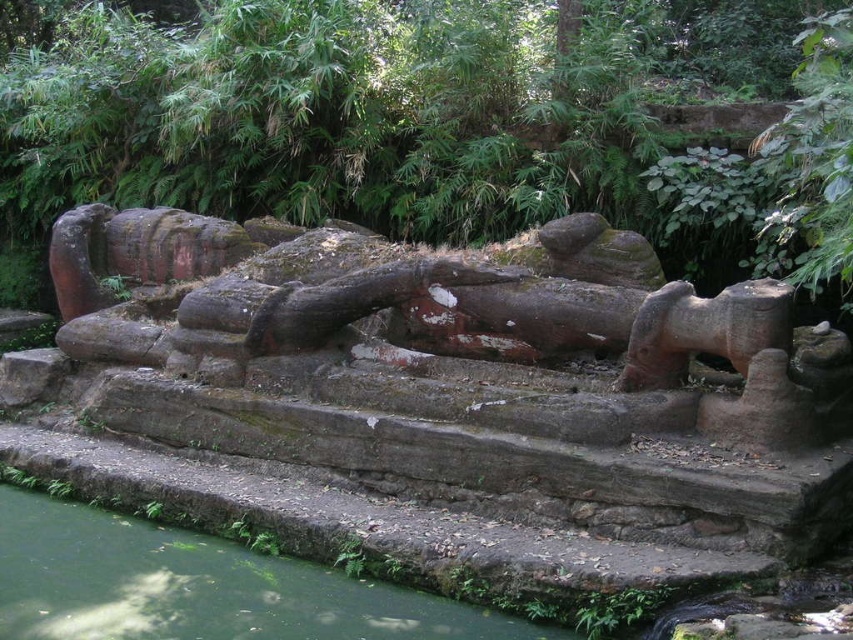
Question: Is green mossy rock at center wider than green mossy water at lower left?

Choices:
 (A) no
 (B) yes

Answer: (A)

Question: Which point appears farthest from the camera in this image?

Choices:
 (A) (306, 112)
 (B) (0, 560)

Answer: (A)

Question: Is green mossy rock at center below green mossy water at lower left?

Choices:
 (A) no
 (B) yes

Answer: (A)

Question: Does green mossy rock at center appear over green mossy water at lower left?

Choices:
 (A) no
 (B) yes

Answer: (B)

Question: Which object is farther from the camera taking this photo?

Choices:
 (A) green mossy rock at center
 (B) green mossy water at lower left

Answer: (A)